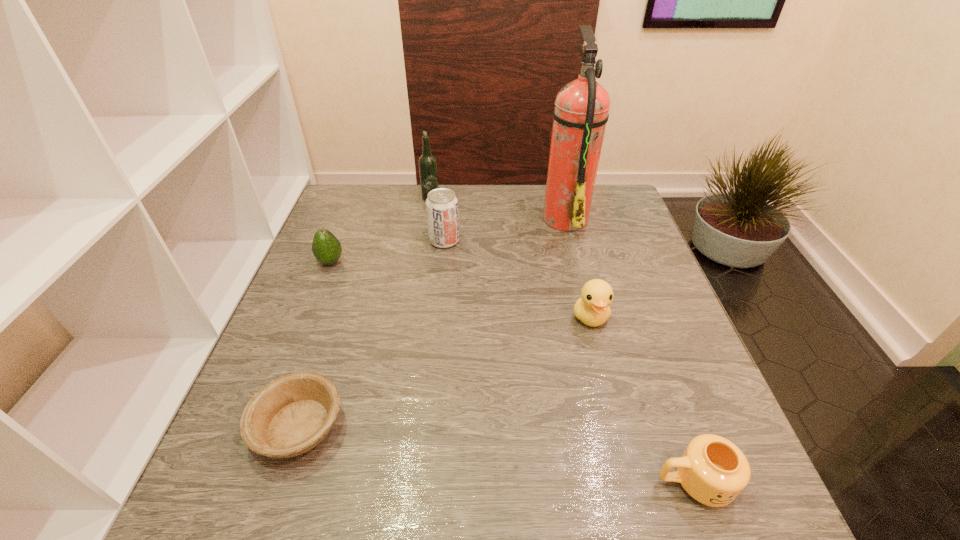
Where is `free space at the far edge of the desktop`? The height and width of the screenshot is (540, 960). free space at the far edge of the desktop is located at coordinates (479, 207).

Find the location of `free space at the near edge of the desktop`. free space at the near edge of the desktop is located at coordinates (651, 495).

In the image, there is a desktop. Where is `vacant space at the left edge`? The image size is (960, 540). vacant space at the left edge is located at coordinates tap(269, 362).

Image resolution: width=960 pixels, height=540 pixels. In order to click on vacant area at the right edge of the desktop in this screenshot , I will do `click(646, 269)`.

In the image, there is a desktop. Identify the location of vacant space at the far left corner. The width and height of the screenshot is (960, 540). (385, 190).

Identify the location of free point at the near left corner. Image resolution: width=960 pixels, height=540 pixels. (252, 482).

You are a GUI agent. You are given a task and a screenshot of the screen. Output one action in this format:
    pyautogui.click(x=<x>, y=<y>)
    Task: Click on the vacant position at the far right corner of the desktop
    This screenshot has width=960, height=540.
    Given the screenshot: What is the action you would take?
    pyautogui.click(x=600, y=195)

This screenshot has height=540, width=960. Identify the location of free space between the fifth shortest object and the duck. (517, 279).

Identify the location of free area in between the duck and the fire extinguisher. (578, 267).

Where is `free space between the fifth shortest object and the mug`? This screenshot has width=960, height=540. free space between the fifth shortest object and the mug is located at coordinates (569, 361).